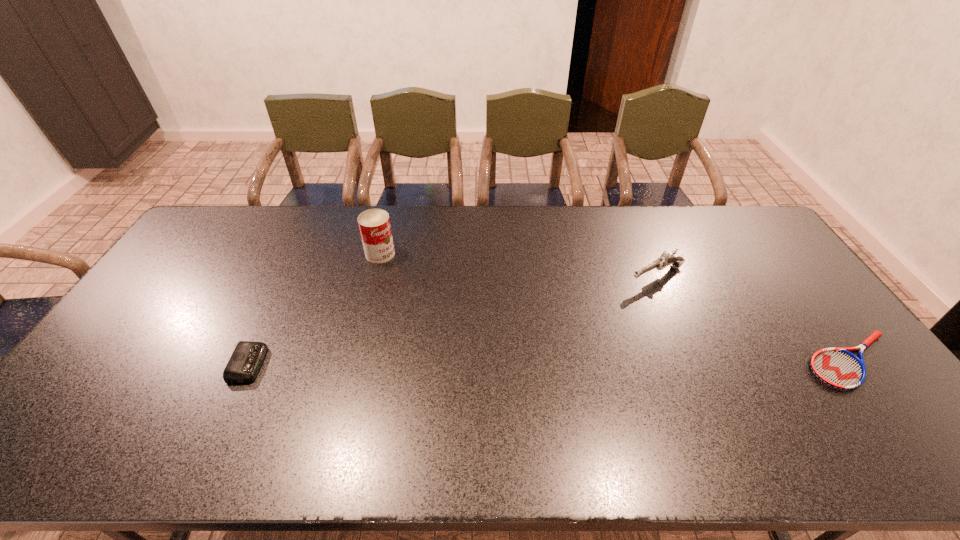
At what (x,y) coordinates should I click in order to perform the action: click on vacant space on the desktop that is between the third tallest object and the rightmost object and is positioned on the front label of the second object from left to right. Please return your answer as a coordinate pair (x, y). This screenshot has width=960, height=540. Looking at the image, I should click on (540, 362).

The image size is (960, 540). Find the location of `vacant space on the desktop that is between the alarm clock and the shortest object and is positioned aimed along the barrel of the third object from left to right`. vacant space on the desktop that is between the alarm clock and the shortest object and is positioned aimed along the barrel of the third object from left to right is located at coordinates (488, 363).